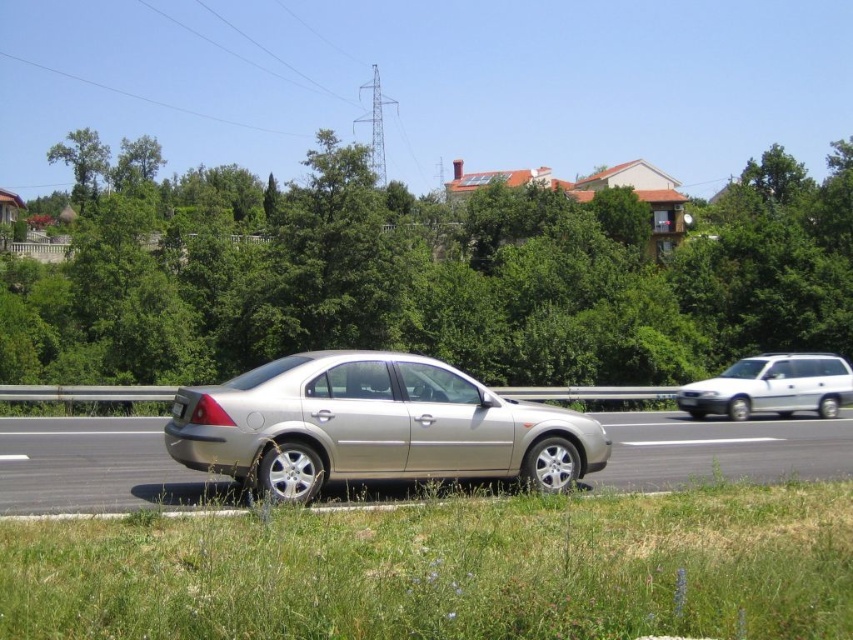
Question: Can you confirm if green leafy tree at center is thinner than green grass at lower center?

Choices:
 (A) yes
 (B) no

Answer: (B)

Question: Which of these objects is positioned closest to the silver metallic license plate at center?

Choices:
 (A) green leafy tree at upper left
 (B) satin silver car at center

Answer: (B)

Question: Is silver metallic car at center positioned in front of green leafy tree at upper left?

Choices:
 (A) yes
 (B) no

Answer: (A)

Question: Considering the real-world distances, which object is closest to the green leafy tree at upper left?

Choices:
 (A) satin silver car at center
 (B) white matte suv at right
 (C) silver metallic car at center

Answer: (B)

Question: Can you confirm if green leafy tree at center is wider than green grass at lower center?

Choices:
 (A) no
 (B) yes

Answer: (B)

Question: Estimate the real-world distances between objects in this image. Which object is closer to the satin silver car at center?

Choices:
 (A) silver metallic license plate at center
 (B) green leafy tree at upper left

Answer: (A)